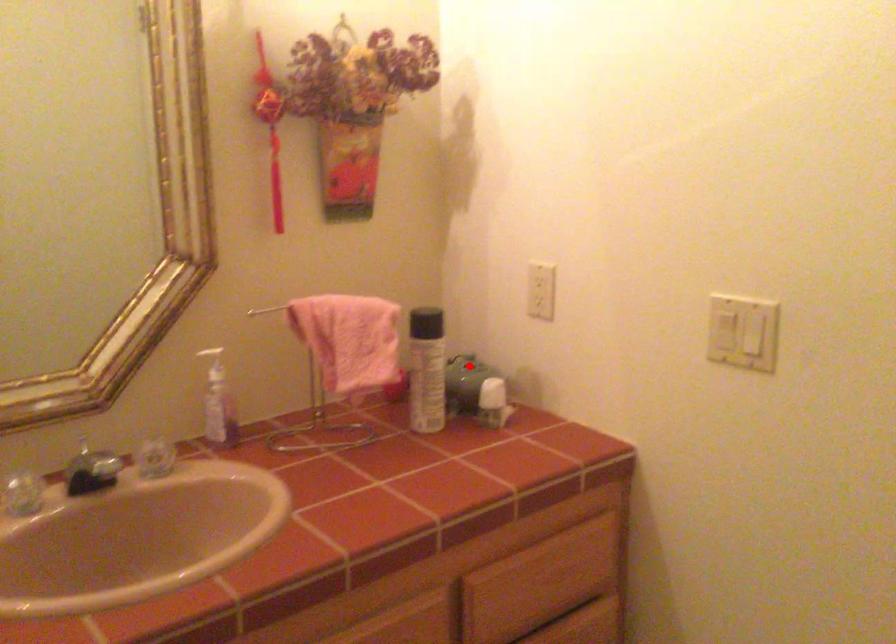
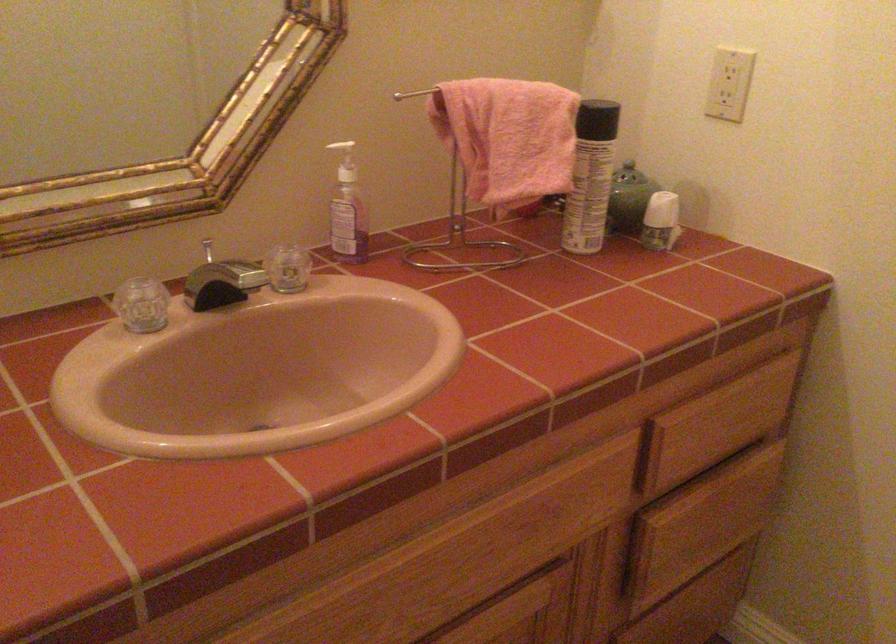
Question: I am providing you with two images of the same scene from different viewpoints. A red point is shown in image1. For the corresponding object point in image2, is it positioned nearer or farther from the camera?

Choices:
 (A) Nearer
 (B) Farther

Answer: (A)